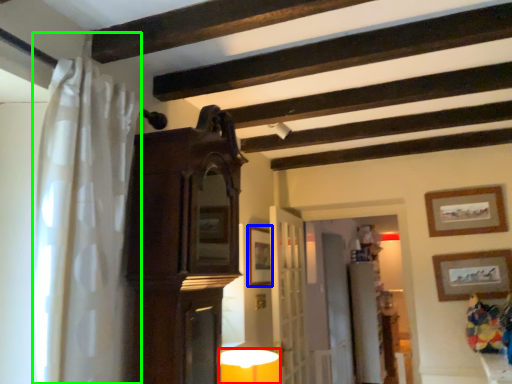
Question: Which object is the closest to the table lamp (highlighted by a red box)? Choose among these: picture frame (highlighted by a blue box) or shower curtain (highlighted by a green box).

Choices:
 (A) picture frame
 (B) shower curtain

Answer: (A)